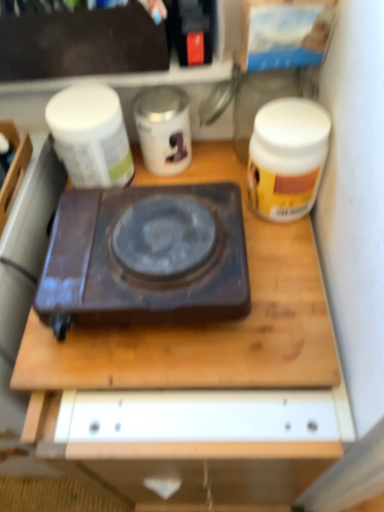
The height and width of the screenshot is (512, 384). I want to click on vacant space in front of dark brown plastic gas stove at center, so click(x=176, y=420).